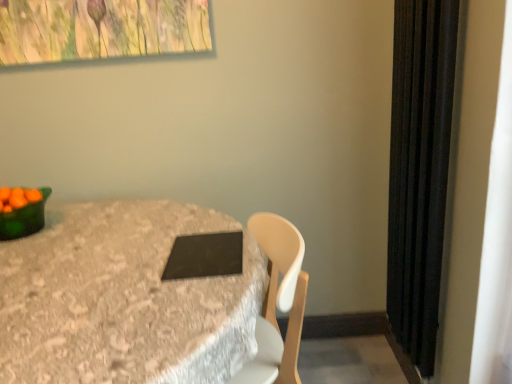
Question: Is green matte bowl at left looking in the opposite direction of green glossy bowl at left?

Choices:
 (A) yes
 (B) no

Answer: (B)

Question: Does green matte bowl at left have a smaller size compared to green glossy bowl at left?

Choices:
 (A) yes
 (B) no

Answer: (A)

Question: Considering the relative sizes of green matte bowl at left and green glossy bowl at left in the image provided, is green matte bowl at left wider than green glossy bowl at left?

Choices:
 (A) no
 (B) yes

Answer: (A)

Question: Is green matte bowl at left aimed at green glossy bowl at left?

Choices:
 (A) yes
 (B) no

Answer: (B)

Question: Is green matte bowl at left bigger than green glossy bowl at left?

Choices:
 (A) yes
 (B) no

Answer: (B)

Question: From the image's perspective, is green matte bowl at left located beneath green glossy bowl at left?

Choices:
 (A) no
 (B) yes

Answer: (A)

Question: Does green glossy bowl at left have a greater width compared to matte black tablet at center?

Choices:
 (A) no
 (B) yes

Answer: (A)

Question: Is green glossy bowl at left located outside matte black tablet at center?

Choices:
 (A) yes
 (B) no

Answer: (B)

Question: Considering the relative sizes of green glossy bowl at left and matte black tablet at center in the image provided, is green glossy bowl at left shorter than matte black tablet at center?

Choices:
 (A) no
 (B) yes

Answer: (B)

Question: Does green glossy bowl at left have a larger size compared to matte black tablet at center?

Choices:
 (A) yes
 (B) no

Answer: (B)

Question: From the image's perspective, is green glossy bowl at left over matte black tablet at center?

Choices:
 (A) no
 (B) yes

Answer: (B)

Question: Is green glossy bowl at left at the left side of matte black tablet at center?

Choices:
 (A) no
 (B) yes

Answer: (B)

Question: From the image's perspective, does matte black tablet at center appear higher than green glossy bowl at left?

Choices:
 (A) yes
 (B) no

Answer: (B)